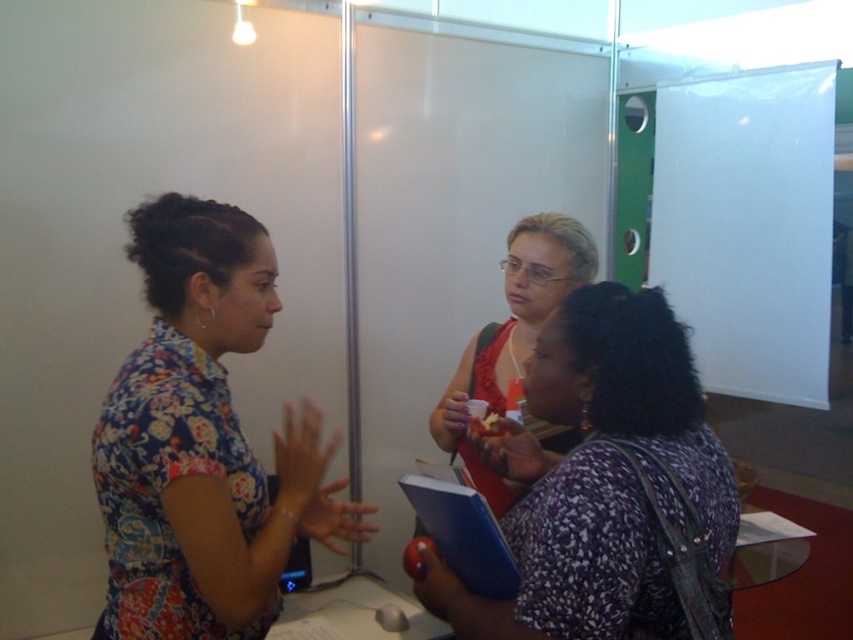
Does floral fabric shirt at left appear on the left side of speckled fabric purse at lower right?

Yes, floral fabric shirt at left is to the left of speckled fabric purse at lower right.

Measure the distance between floral fabric shirt at left and speckled fabric purse at lower right.

They are 17.59 inches apart.

The width and height of the screenshot is (853, 640). Identify the location of floral fabric shirt at left. (202, 442).

Between point (131, 436) and point (509, 252), which one is positioned in front?

Positioned in front is point (131, 436).

Does floral fabric shirt at left have a greater width compared to matte red dress at center?

Yes.

Is point (120, 474) farther from viewer compared to point (566, 276)?

No, (120, 474) is closer to viewer.

Locate an element on the screen. The width and height of the screenshot is (853, 640). floral fabric shirt at left is located at coordinates (202, 442).

Who is lower down, speckled fabric purse at lower right or matte red dress at center?

speckled fabric purse at lower right is below.

The width and height of the screenshot is (853, 640). What do you see at coordinates (608, 486) in the screenshot?
I see `speckled fabric purse at lower right` at bounding box center [608, 486].

The width and height of the screenshot is (853, 640). In order to click on speckled fabric purse at lower right in this screenshot , I will do `click(608, 486)`.

This screenshot has width=853, height=640. What are the coordinates of `speckled fabric purse at lower right` in the screenshot? It's located at (608, 486).